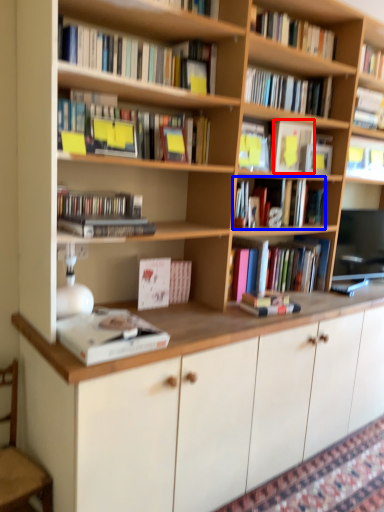
Question: Which point is closer to the camera, paperback book (highlighted by a red box) or book (highlighted by a blue box)?

Choices:
 (A) paperback book
 (B) book

Answer: (A)